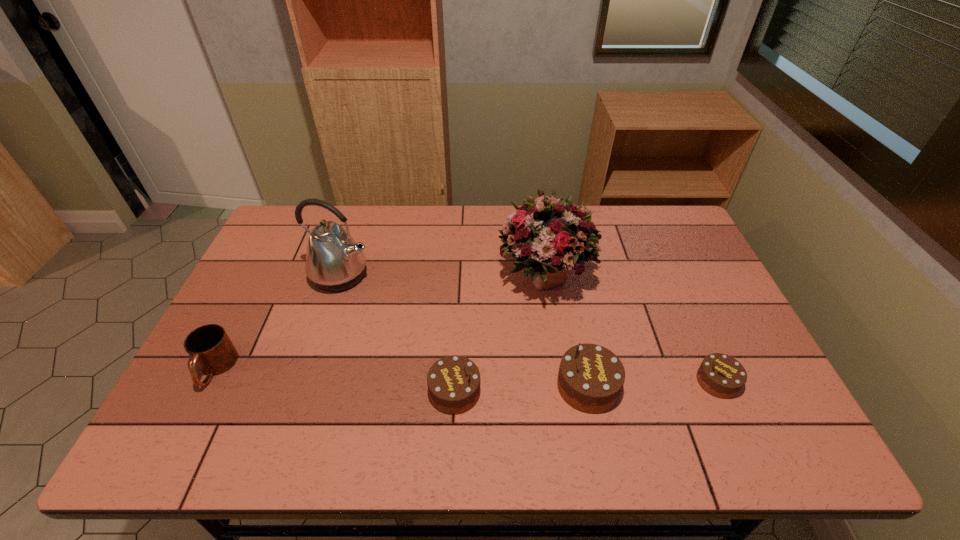
Identify the location of vacant space located 0.150m on the left of the second chocolate cake from right to left. The width and height of the screenshot is (960, 540). (495, 386).

The height and width of the screenshot is (540, 960). In order to click on vacant space situated 0.100m on the back of the rightmost chocolate cake in this screenshot , I will do `click(696, 334)`.

Identify the location of free space located on the left of the kettle. coord(265,275).

You are a GUI agent. You are given a task and a screenshot of the screen. Output one action in this format:
    pyautogui.click(x=<x>, y=<y>)
    Task: Click on the free space located 0.090m on the front of the bouquet
    
    Given the screenshot: What is the action you would take?
    pyautogui.click(x=554, y=340)

This screenshot has height=540, width=960. In order to click on free space located 0.050m on the side of the leftmost object with the handle in this screenshot , I will do `click(193, 412)`.

You are a GUI agent. You are given a task and a screenshot of the screen. Output one action in this format:
    pyautogui.click(x=<x>, y=<y>)
    Task: Click on the object present at the far edge
    The image size is (960, 540).
    Given the screenshot: What is the action you would take?
    pyautogui.click(x=549, y=236)

Find the location of `mug present at the near edge`. mug present at the near edge is located at coordinates (211, 350).

In order to click on object that is positioned at the left edge in this screenshot , I will do `click(211, 350)`.

Find the location of a particular element. Image resolution: width=960 pixels, height=540 pixels. object located in the right edge section of the desktop is located at coordinates (720, 375).

Locate an element on the screen. The height and width of the screenshot is (540, 960). object that is at the near left corner is located at coordinates (211, 350).